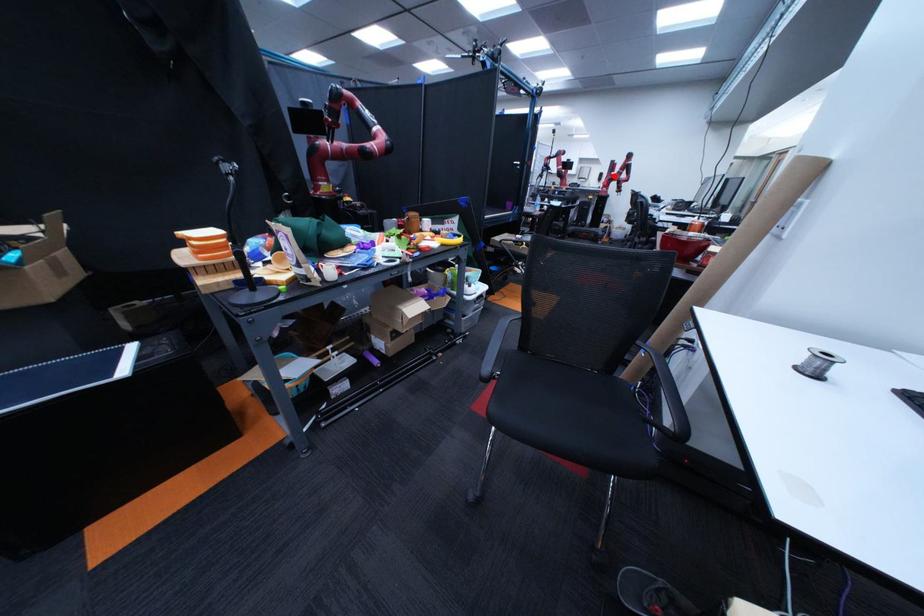
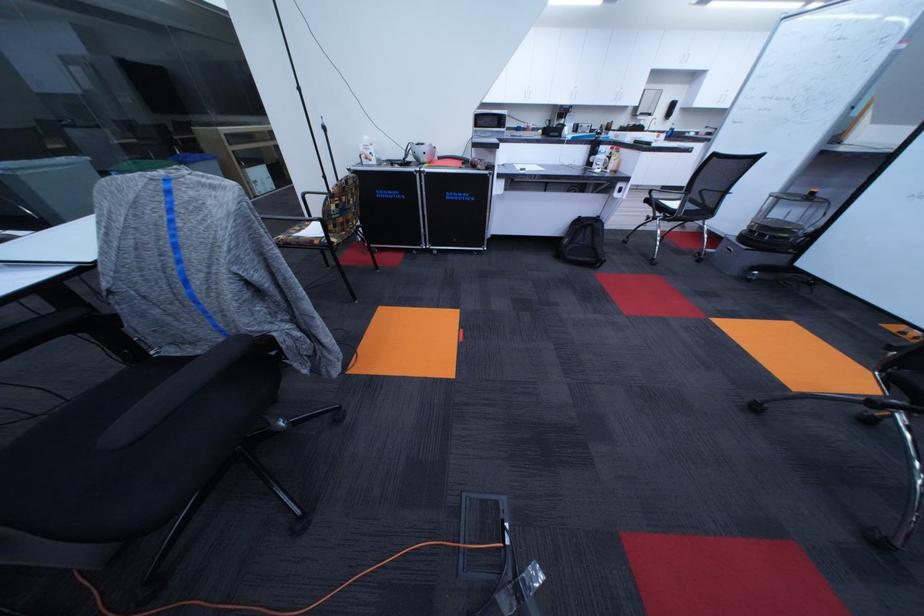
Question: A red point is marked in image1. In image2, is the corresponding 3D point closer to the camera or farther? Reply with the corresponding letter.

Choices:
 (A) The corresponding 3D point is closer.
 (B) The corresponding 3D point is farther.

Answer: (B)